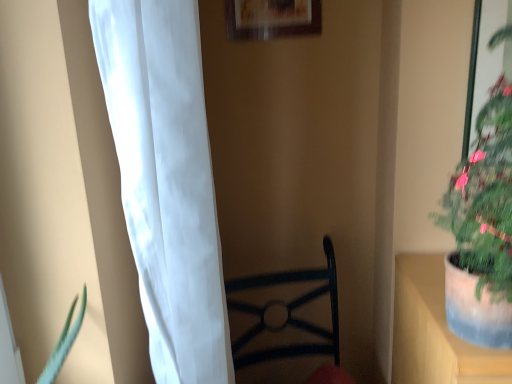
Question: From a real-world perspective, does wooden picture frame at upper center stand above white sheer curtain at left?

Choices:
 (A) no
 (B) yes

Answer: (B)

Question: Could you tell me if wooden picture frame at upper center is facing white sheer curtain at left?

Choices:
 (A) yes
 (B) no

Answer: (B)

Question: Is wooden picture frame at upper center next to white sheer curtain at left?

Choices:
 (A) yes
 (B) no

Answer: (B)

Question: Is white sheer curtain at left completely or partially inside wooden picture frame at upper center?

Choices:
 (A) no
 (B) yes

Answer: (A)

Question: Does wooden picture frame at upper center appear on the right side of white sheer curtain at left?

Choices:
 (A) no
 (B) yes

Answer: (B)

Question: Considering the positions of point (458, 228) and point (192, 218), is point (458, 228) closer or farther from the camera than point (192, 218)?

Choices:
 (A) closer
 (B) farther

Answer: (B)

Question: Is green matte plant at right situated inside white sheer curtain at left or outside?

Choices:
 (A) inside
 (B) outside

Answer: (B)

Question: Based on their sizes in the image, would you say green matte plant at right is bigger or smaller than white sheer curtain at left?

Choices:
 (A) big
 (B) small

Answer: (B)

Question: Is green matte plant at right to the left or to the right of white sheer curtain at left in the image?

Choices:
 (A) left
 (B) right

Answer: (B)

Question: Is point (287, 31) positioned closer to the camera than point (494, 158)?

Choices:
 (A) closer
 (B) farther

Answer: (B)

Question: In the image, is wooden picture frame at upper center positioned in front of or behind green matte plant at right?

Choices:
 (A) behind
 (B) front

Answer: (A)

Question: From the image's perspective, relative to green matte plant at right, is wooden picture frame at upper center above or below?

Choices:
 (A) below
 (B) above

Answer: (B)

Question: In the image, is wooden picture frame at upper center on the left side or the right side of green matte plant at right?

Choices:
 (A) right
 (B) left

Answer: (B)

Question: From their relative heights in the image, would you say white sheer curtain at left is taller or shorter than green matte plant at right?

Choices:
 (A) tall
 (B) short

Answer: (A)

Question: In the image, is white sheer curtain at left positioned in front of or behind green matte plant at right?

Choices:
 (A) behind
 (B) front

Answer: (A)